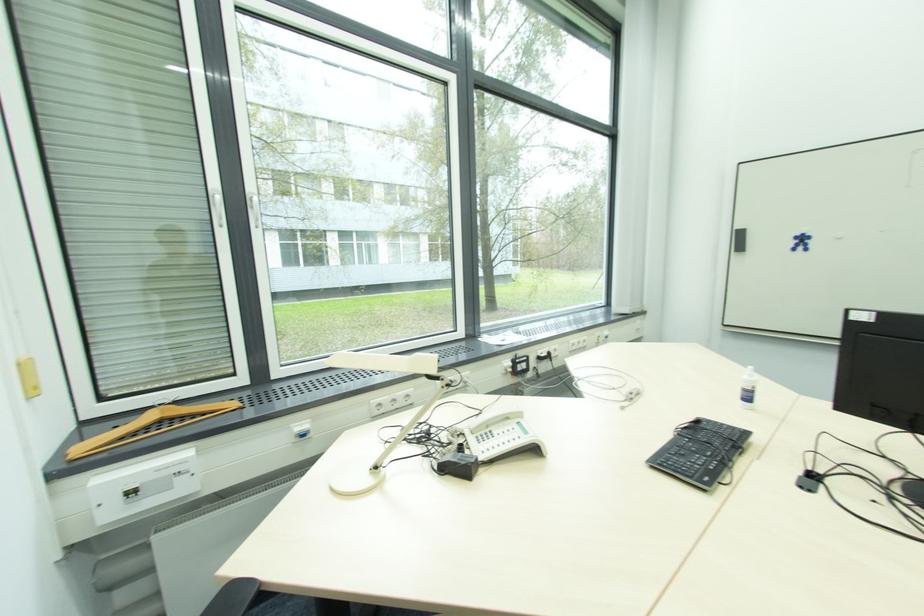
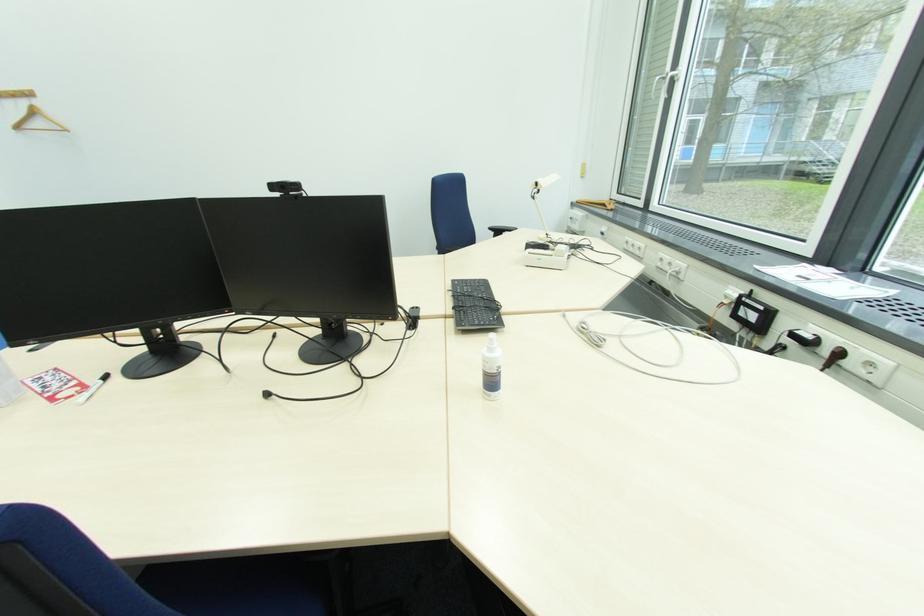
The point at [710,480] is marked in the first image. Where is the corresponding point in the second image?

(459, 285)